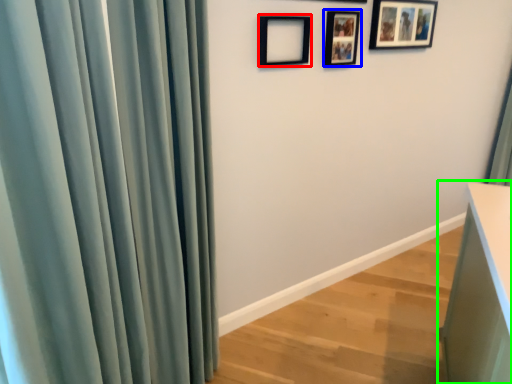
Question: Considering the real-world distances, which object is closest to picture frame (highlighted by a red box)? picture frame (highlighted by a blue box) or vanity (highlighted by a green box).

Choices:
 (A) picture frame
 (B) vanity

Answer: (A)